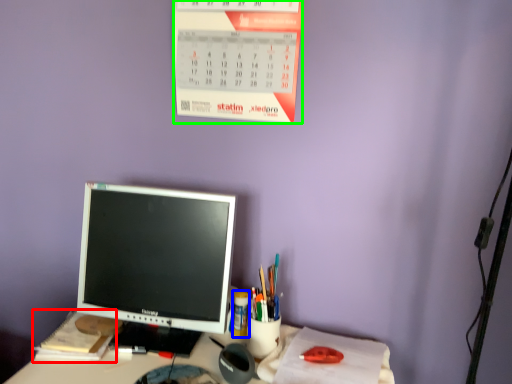
Question: Which is farther away from notebook (highlighted by a red box)? stationery (highlighted by a blue box) or calendar (highlighted by a green box)?

Choices:
 (A) stationery
 (B) calendar

Answer: (B)